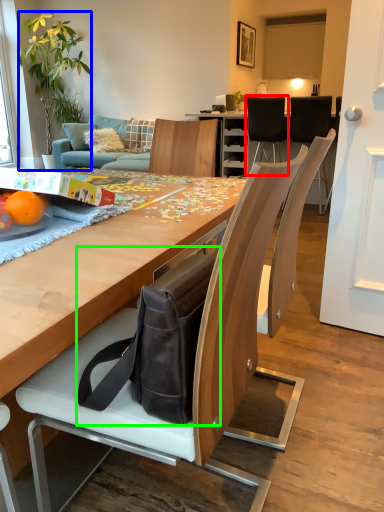
Question: Which object is positioned closest to chair (highlighted by a red box)? Select from houseplant (highlighted by a blue box) and messenger bag (highlighted by a green box).

Choices:
 (A) houseplant
 (B) messenger bag

Answer: (A)